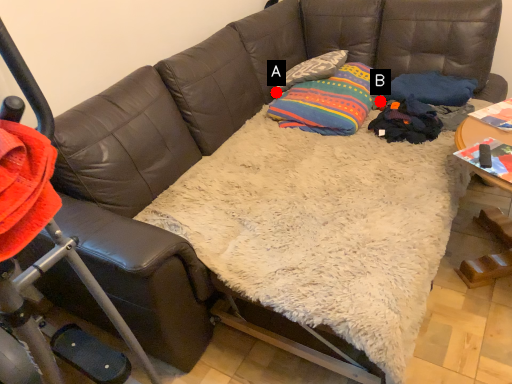
Question: Two points are circled on the image, labeled by A and B beside each circle. Which point appears closest to the camera in this image?

Choices:
 (A) A is closer
 (B) B is closer

Answer: (B)